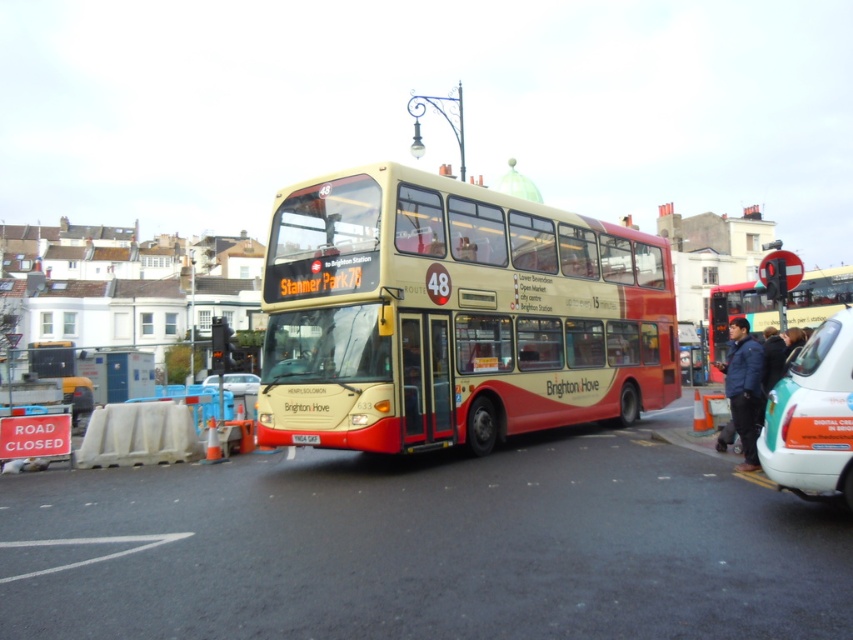
Is red matte bus at right thinner than white plastic license plate at center?

In fact, red matte bus at right might be wider than white plastic license plate at center.

Does red matte bus at right appear on the left side of white plastic license plate at center?

No, red matte bus at right is not to the left of white plastic license plate at center.

In the scene shown: Who is more distant from viewer, (724,314) or (297,436)?

Point (724,314)

Locate an element on the screen. The image size is (853, 640). red matte bus at right is located at coordinates [735, 316].

At what (x,y) coordinates should I click in order to perform the action: click on metallic silver car at center. Please return your answer as a coordinate pair (x, y). Looking at the image, I should click on (241, 381).

How distant is metallic silver car at center from white plastic license plate at center?

The distance of metallic silver car at center from white plastic license plate at center is 9.68 meters.

In the scene shown: Who is more forward, (228, 381) or (314, 442)?

Point (314, 442) is in front.

At what (x,y) coordinates should I click in order to perform the action: click on metallic silver car at center. Please return your answer as a coordinate pair (x, y). Looking at the image, I should click on (241, 381).

Which is more to the left, matte gold bus at center or teal matte taxi at lower right?

From the viewer's perspective, matte gold bus at center appears more on the left side.

Is matte gold bus at center positioned at the back of teal matte taxi at lower right?

Yes, it is.

Locate an element on the screen. The height and width of the screenshot is (640, 853). matte gold bus at center is located at coordinates (454, 316).

The height and width of the screenshot is (640, 853). Identify the location of matte gold bus at center. (454, 316).